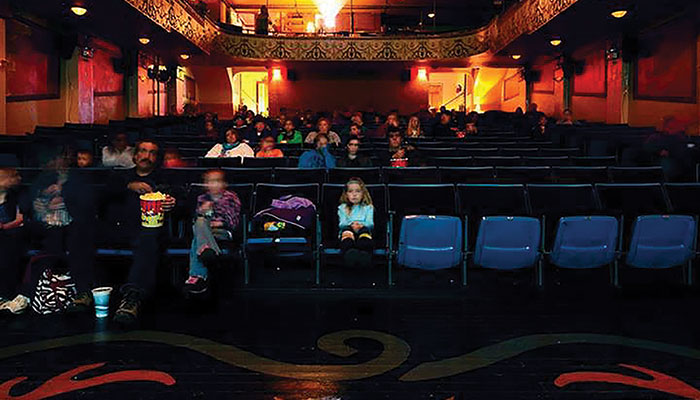
Identify the location of projector. (328, 24).